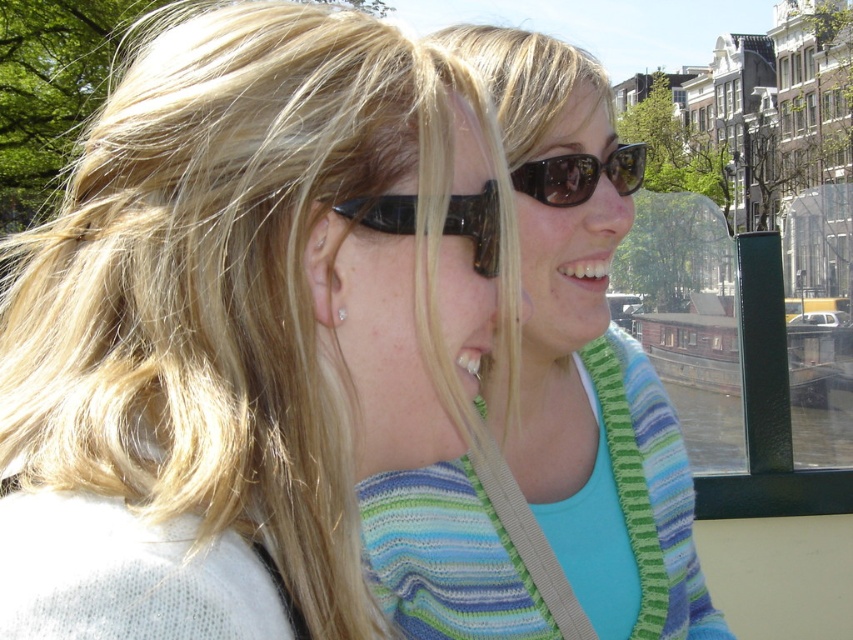
Can you confirm if matte black sunglasses at upper center is taller than black plastic sunglasses at upper center?

Yes.

Does matte black sunglasses at upper center appear on the left side of black plastic sunglasses at upper center?

Indeed, matte black sunglasses at upper center is positioned on the left side of black plastic sunglasses at upper center.

Is point (257, 257) closer to camera compared to point (483, 205)?

That is True.

Identify the location of matte black sunglasses at upper center. (244, 326).

Can you confirm if striped sweater at center is positioned to the left of wooden cabin cruiser at center?

Yes, striped sweater at center is to the left of wooden cabin cruiser at center.

Is striped sweater at center shorter than wooden cabin cruiser at center?

No.

What do you see at coordinates (601, 442) in the screenshot? I see `striped sweater at center` at bounding box center [601, 442].

You are a GUI agent. You are given a task and a screenshot of the screen. Output one action in this format:
    pyautogui.click(x=<x>, y=<y>)
    Task: Click on the striped sweater at center
    The height and width of the screenshot is (640, 853).
    Given the screenshot: What is the action you would take?
    pyautogui.click(x=601, y=442)

Does black plastic sunglasses at upper center have a lesser height compared to white glossy teeth at center?

No.

Which of these two, black plastic sunglasses at upper center or white glossy teeth at center, stands shorter?

Standing shorter between the two is white glossy teeth at center.

This screenshot has height=640, width=853. Identify the location of black plastic sunglasses at upper center. (477, 225).

This screenshot has width=853, height=640. What are the coordinates of `black plastic sunglasses at upper center` in the screenshot? It's located at (477, 225).